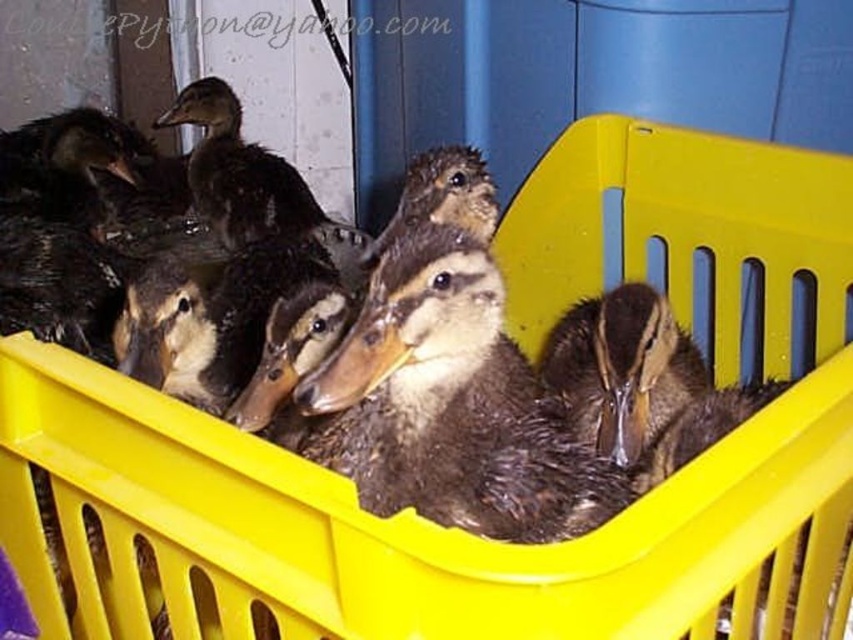
Is dark brown feathers at center to the left of dark brown feathers at upper center from the viewer's perspective?

Incorrect, dark brown feathers at center is not on the left side of dark brown feathers at upper center.

In order to click on dark brown feathers at center in this screenshot , I will do `click(451, 404)`.